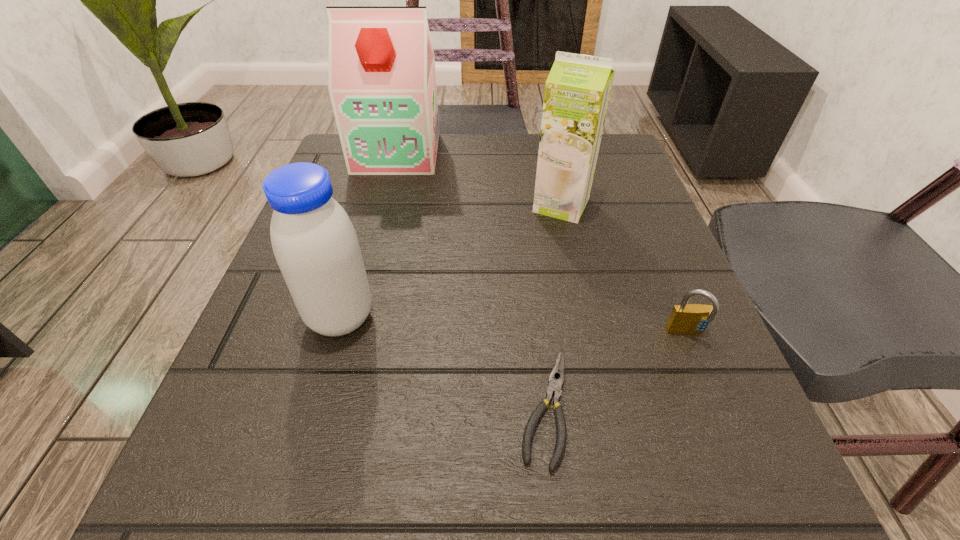
Find the location of a particular element. This screenshot has width=960, height=540. free space at the right edge of the desktop is located at coordinates (701, 345).

What are the coordinates of `free space at the far left corner of the desktop` in the screenshot? It's located at (349, 186).

Find the location of `vacant space at the far right corner of the desktop`. vacant space at the far right corner of the desktop is located at coordinates (633, 168).

Where is `free space between the nearest soya milk and the second farthest soya milk`? free space between the nearest soya milk and the second farthest soya milk is located at coordinates (451, 261).

Image resolution: width=960 pixels, height=540 pixels. In order to click on vacant space in between the nearest soya milk and the farthest soya milk in this screenshot , I will do (x=369, y=235).

Identify the location of free space between the farthest soya milk and the pliers. (471, 280).

Identify the location of free area in between the fourth nearest object and the nearest soya milk. Image resolution: width=960 pixels, height=540 pixels. (451, 261).

What are the coordinates of `free area in between the farthest soya milk and the nearest soya milk` in the screenshot? It's located at tap(369, 235).

Where is `empty location between the nearest soya milk and the nearest object`? empty location between the nearest soya milk and the nearest object is located at coordinates (443, 362).

Where is `free spot between the nearest soya milk and the farthest object`? This screenshot has height=540, width=960. free spot between the nearest soya milk and the farthest object is located at coordinates (369, 235).